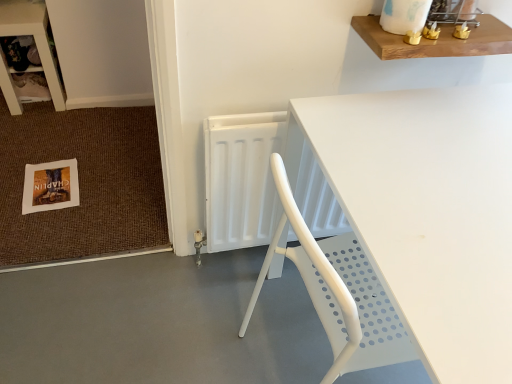
Locate an element on the screen. free space in front of white paper postcard at lower left is located at coordinates (38, 228).